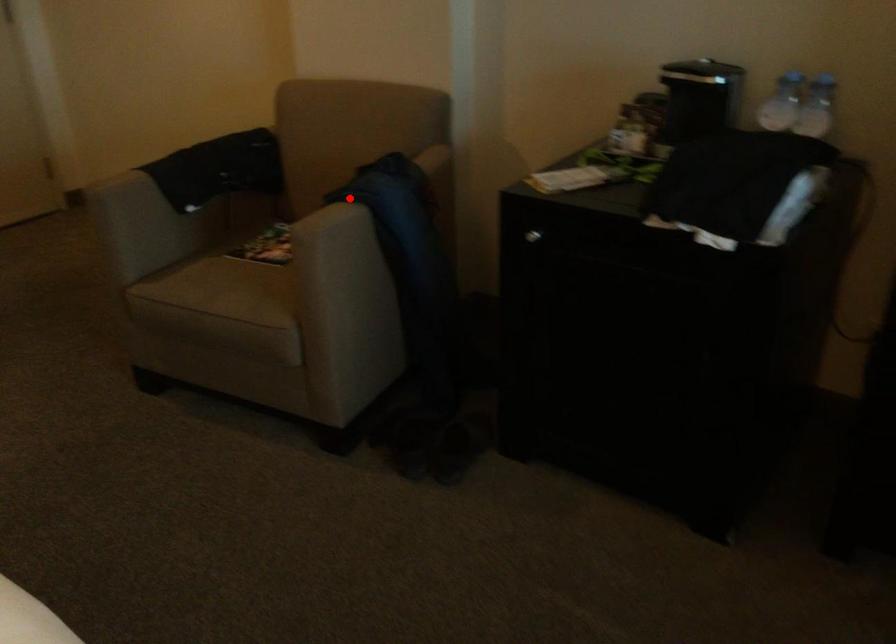
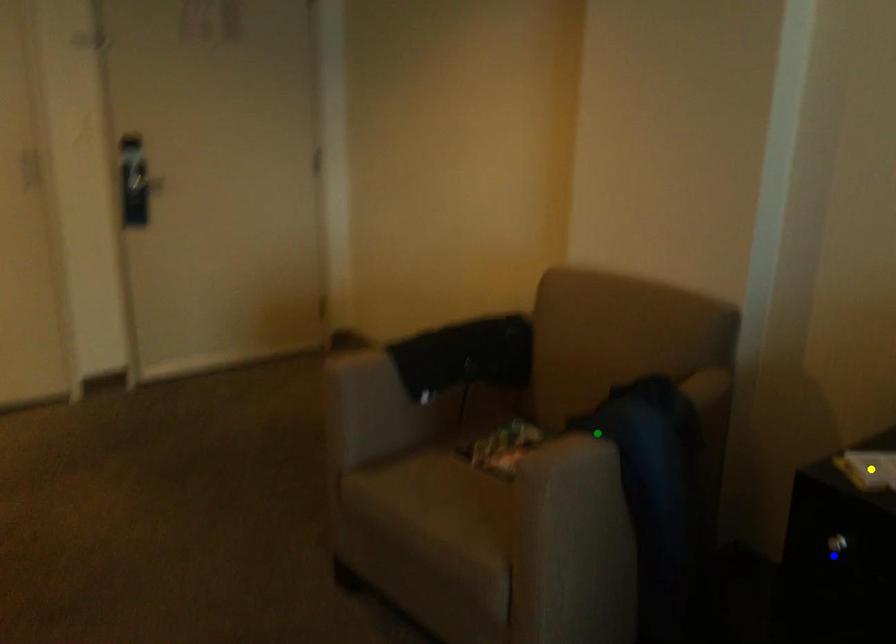
Question: I am providing you with two images of the same scene from different viewpoints. A red point is marked on the first image. You are given multiple points on the second image. Which point in image 2 represents the same 3d spot as the red point in image 1?

Choices:
 (A) yellow point
 (B) blue point
 (C) green point

Answer: (C)